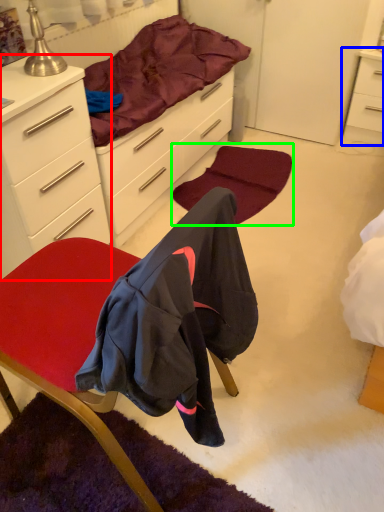
Question: Which object is the farthest from cabinetry (highlighted by a red box)? Choose among these: nightstand (highlighted by a blue box) or mat (highlighted by a green box).

Choices:
 (A) nightstand
 (B) mat

Answer: (A)